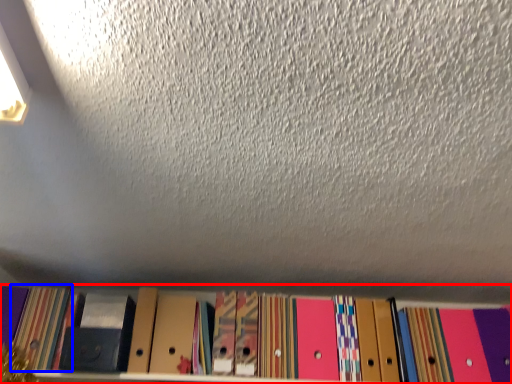
Question: Which object is further to the camera taking this photo, shelf (highlighted by a red box) or paperback book (highlighted by a blue box)?

Choices:
 (A) shelf
 (B) paperback book

Answer: (B)